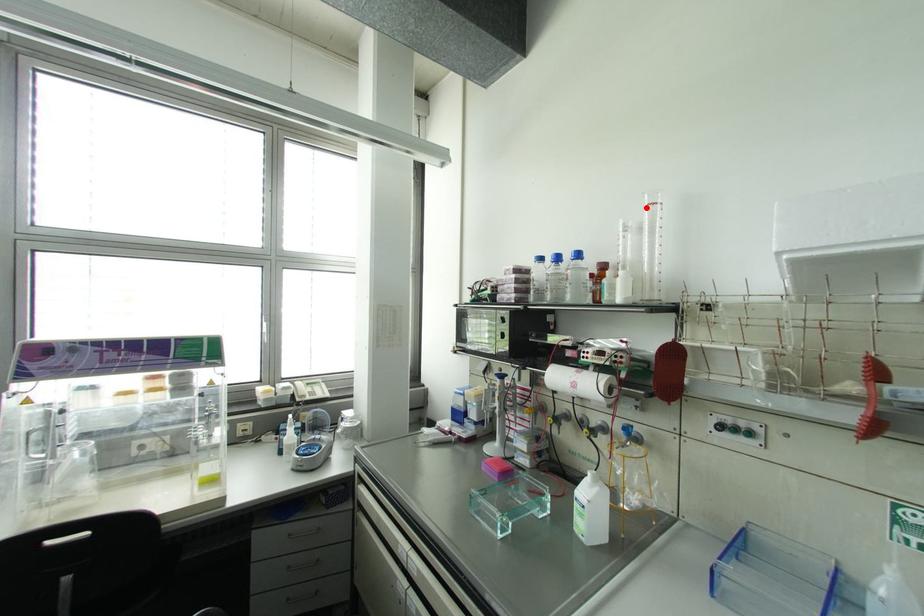
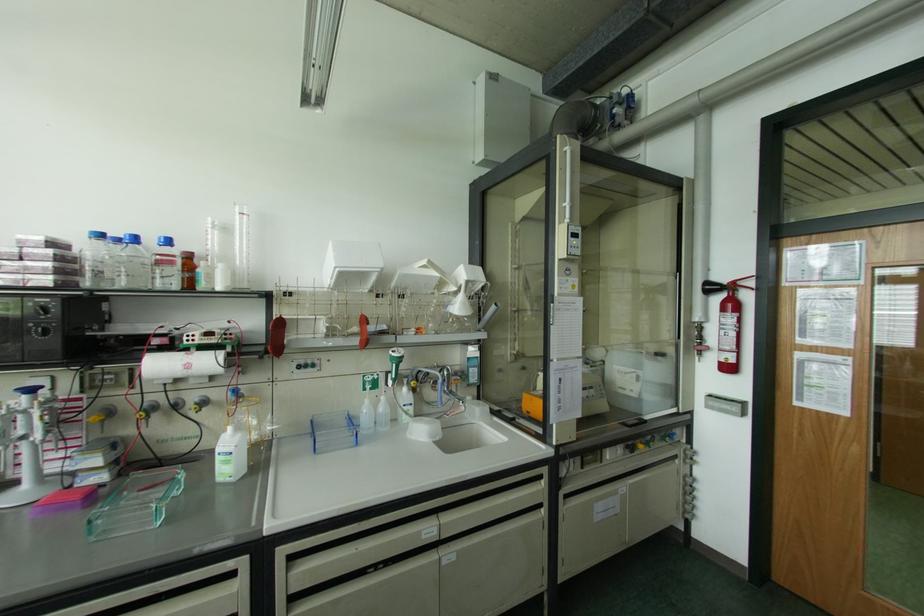
Question: I am providing you with two images of the same scene from different viewpoints. A red point is marked on the first image. Can you still see the location of the red point in image 2?

Choices:
 (A) Yes
 (B) No

Answer: (A)